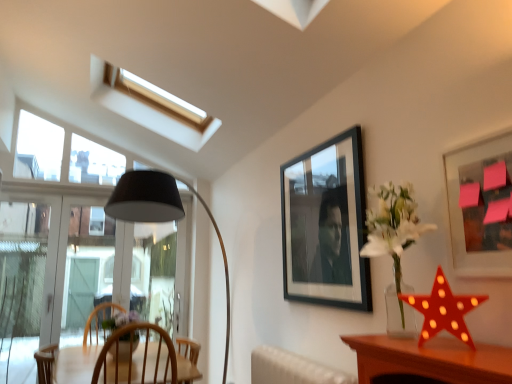
Question: Is matte black picture frame at upper right, which appears as the second picture frame when viewed from the back, positioned before red plastic star at right?

Choices:
 (A) yes
 (B) no

Answer: (A)

Question: From the image's perspective, is matte black picture frame at upper right, positioned as the second picture frame in left-to-right order, over red plastic star at right?

Choices:
 (A) no
 (B) yes

Answer: (B)

Question: Does matte black picture frame at upper right, positioned as the 1th picture frame in right-to-left order, contain red plastic star at right?

Choices:
 (A) no
 (B) yes

Answer: (A)

Question: Is matte black picture frame at upper right, which is counted as the 1th picture frame, starting from the front, smaller than red plastic star at right?

Choices:
 (A) no
 (B) yes

Answer: (A)

Question: Considering the relative sizes of matte black picture frame at upper right, positioned as the 1th picture frame in right-to-left order, and red plastic star at right in the image provided, is matte black picture frame at upper right, positioned as the 1th picture frame in right-to-left order, taller than red plastic star at right?

Choices:
 (A) yes
 (B) no

Answer: (A)

Question: Considering their positions, is matte black picture frame at upper right, which appears as the second picture frame when viewed from the back, located in front of or behind black matte picture frame at upper center, which is the 2th picture frame from right to left?

Choices:
 (A) behind
 (B) front

Answer: (B)

Question: Considering the positions of matte black picture frame at upper right, positioned as the 1th picture frame in right-to-left order, and black matte picture frame at upper center, placed as the first picture frame when sorted from back to front, in the image, is matte black picture frame at upper right, positioned as the 1th picture frame in right-to-left order, taller or shorter than black matte picture frame at upper center, placed as the first picture frame when sorted from back to front,?

Choices:
 (A) short
 (B) tall

Answer: (A)

Question: Is point coord(458,148) closer or farther from the camera than point coord(305,289)?

Choices:
 (A) farther
 (B) closer

Answer: (B)

Question: Based on their positions, is matte black picture frame at upper right, positioned as the 1th picture frame in right-to-left order, located to the left or right of black matte picture frame at upper center, which is counted as the 1th picture frame, starting from the left?

Choices:
 (A) left
 (B) right

Answer: (B)

Question: From a real-world perspective, is transparent glass window at left physically located above or below black matte picture frame at upper center, placed as the first picture frame when sorted from back to front?

Choices:
 (A) above
 (B) below

Answer: (B)

Question: From the image's perspective, is transparent glass window at left positioned above or below black matte picture frame at upper center, arranged as the 2th picture frame when viewed from the front?

Choices:
 (A) below
 (B) above

Answer: (A)

Question: In terms of height, does transparent glass window at left look taller or shorter compared to black matte picture frame at upper center, placed as the first picture frame when sorted from back to front?

Choices:
 (A) short
 (B) tall

Answer: (B)

Question: Visually, is transparent glass window at left positioned to the left or to the right of black matte picture frame at upper center, which is counted as the 1th picture frame, starting from the left?

Choices:
 (A) right
 (B) left

Answer: (B)

Question: In the image, is red plastic star at right on the left side or the right side of black matte picture frame at upper center, which is the 2th picture frame from right to left?

Choices:
 (A) left
 (B) right

Answer: (B)

Question: Looking at their shapes, would you say red plastic star at right is wider or thinner than black matte picture frame at upper center, arranged as the 2th picture frame when viewed from the front?

Choices:
 (A) wide
 (B) thin

Answer: (A)